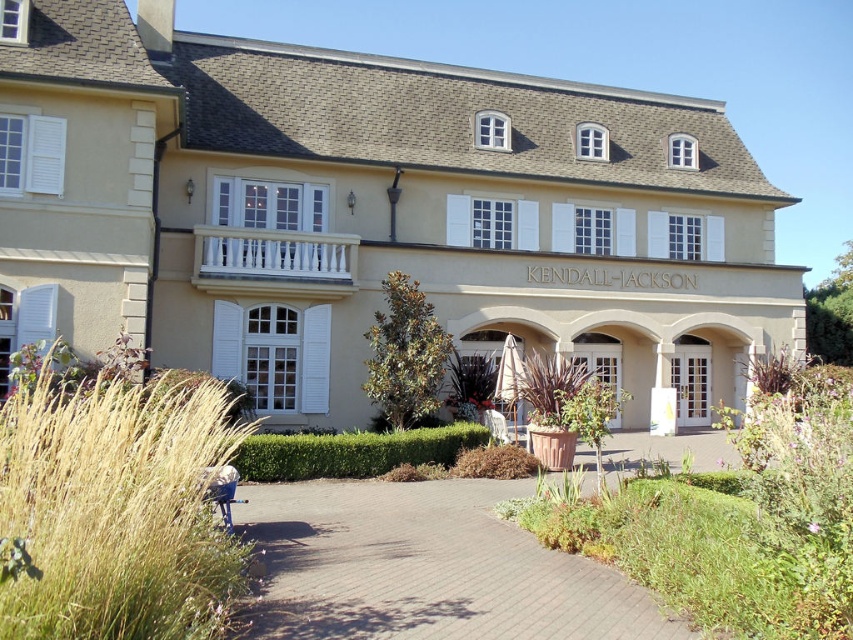
Which is more to the left, beige stucco building at center or golden grass at lower left?

golden grass at lower left is more to the left.

Which is more to the right, beige stucco building at center or golden grass at lower left?

Positioned to the right is beige stucco building at center.

Which is in front, point (178, 54) or point (47, 410)?

Point (47, 410)

Locate an element on the screen. beige stucco building at center is located at coordinates (369, 212).

Is point (469, 554) in front of point (705, 572)?

No, it is not.

Which is more to the left, paved brick driveway at center or green leafy shrubs at center?

Positioned to the left is paved brick driveway at center.

Does point (322, 632) come in front of point (730, 534)?

Yes, it is.

Where is `paved brick driveway at center`? Image resolution: width=853 pixels, height=640 pixels. paved brick driveway at center is located at coordinates (426, 566).

You are a GUI agent. You are given a task and a screenshot of the screen. Output one action in this format:
    pyautogui.click(x=<x>, y=<y>)
    Task: Click on the beige stucco building at center
    This screenshot has height=640, width=853.
    Given the screenshot: What is the action you would take?
    pyautogui.click(x=369, y=212)

Does beige stucco building at center have a smaller size compared to green leafy shrubs at center?

Incorrect, beige stucco building at center is not smaller in size than green leafy shrubs at center.

This screenshot has height=640, width=853. What do you see at coordinates (369, 212) in the screenshot?
I see `beige stucco building at center` at bounding box center [369, 212].

Locate an element on the screen. beige stucco building at center is located at coordinates pos(369,212).